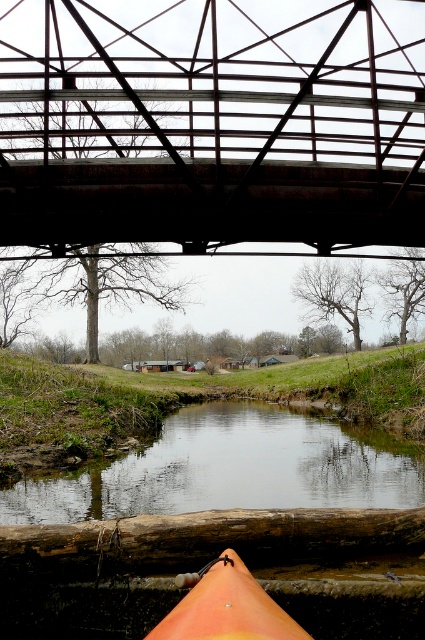
You are standing on the grassy bank of the waterway and want to take a photo of the rusty metal bridge at upper center and the smooth brown water at center. Which object will appear larger in your photo?

The rusty metal bridge at upper center will appear larger in the photo because it is closer to the viewer than the smooth brown water at center.

You are standing on the bank of the waterway and want to cross to the other side. The rusty metal bridge at upper center is your only option. Can you safely walk across it?

The rusty metal bridge at upper center is positioned at point (x=212, y=122), so yes, you can safely walk across it to reach the other side of the waterway.

You are a kayaker planning to navigate under the metal bridge. You see the brown rough wood log at lower center and the orange matte canoe at lower center in the waterway. Which object is closer to the bottom of the waterway?

The brown rough wood log at lower center is below the orange matte canoe at lower right, so it is closer to the bottom of the waterway.